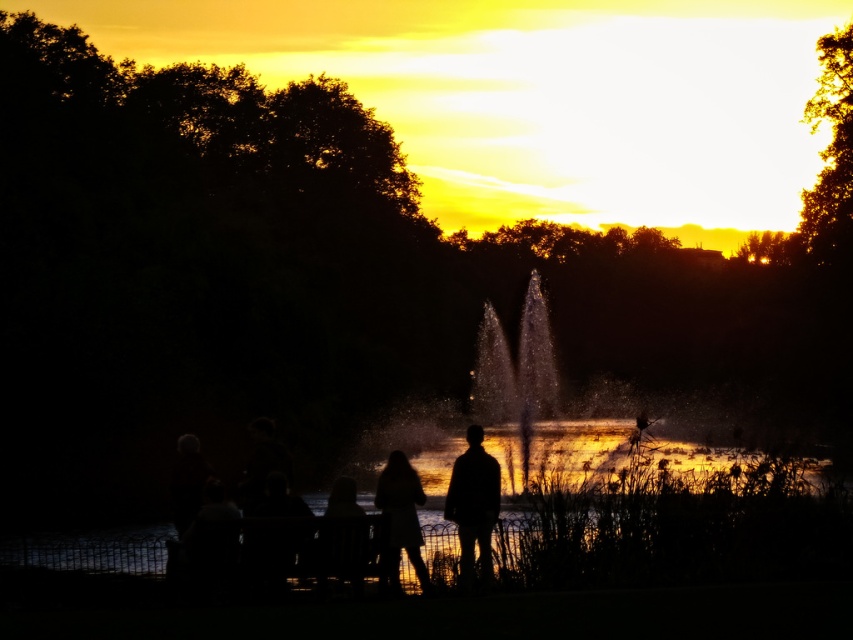
Does silhouette hair at center have a lesser width compared to silhouette fabric person at lower center?

No.

Does point (409, 536) lie in front of point (352, 576)?

No, it is behind (352, 576).

Does point (405, 477) come farther from viewer compared to point (329, 525)?

Yes, point (405, 477) is farther from viewer.

Identify the location of silhouette hair at center. Image resolution: width=853 pixels, height=640 pixels. (399, 518).

Does silhouette figure at center have a lesser height compared to silhouette fabric person at lower center?

No.

Looking at this image, can you confirm if silhouette figure at center is bigger than silhouette fabric person at lower center?

Correct, silhouette figure at center is larger in size than silhouette fabric person at lower center.

Who is more forward, (x=485, y=557) or (x=357, y=529)?

Point (x=357, y=529)

Locate an element on the screen. The width and height of the screenshot is (853, 640). silhouette figure at center is located at coordinates (473, 506).

From the picture: Between silhouette figure at center and silhouette hair at center, which one is positioned higher?

silhouette hair at center

Is silhouette figure at center thinner than silhouette hair at center?

Incorrect, silhouette figure at center's width is not less than silhouette hair at center's.

Does point (480, 508) come closer to viewer compared to point (415, 528)?

That is False.

You are a GUI agent. You are given a task and a screenshot of the screen. Output one action in this format:
    pyautogui.click(x=<x>, y=<y>)
    Task: Click on the silhouette figure at center
    This screenshot has height=640, width=853.
    Given the screenshot: What is the action you would take?
    pyautogui.click(x=473, y=506)